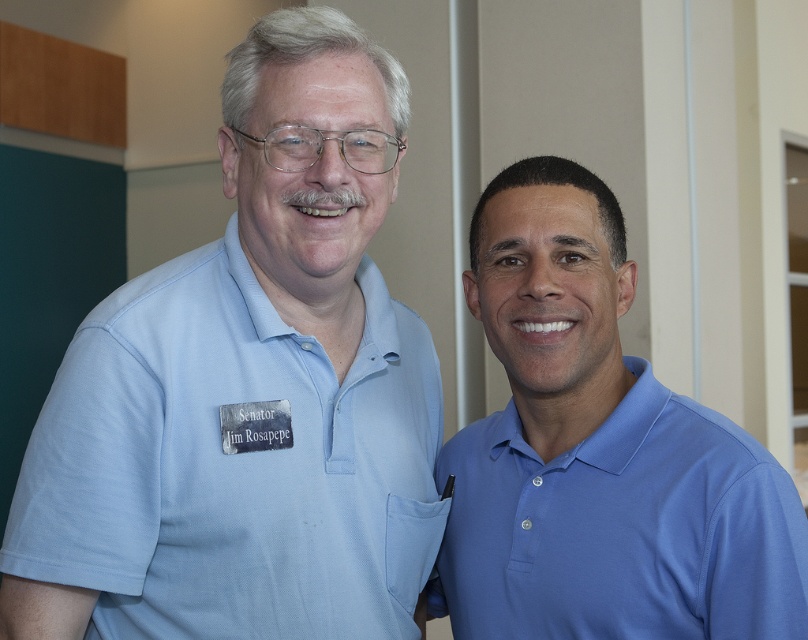
You are standing in front of a photo of two people. The person on the left is wearing a light blue polo shirt. If you were to place a sticker exactly at the center of the light blue polo shirt at left, what coordinates would you use?

The coordinates for the center of the light blue polo shirt at left are at point (247, 388).

You are a photographer setting up for a group photo. You notice two people wearing light blue polo shirt at left and blue smooth polo shirt at right. Since you want to ensure everyone is visible, which person should you position closer to the center to avoid being cut off if the frame is narrower on the sides?

The light blue polo shirt at left should be positioned closer to the center because it has a greater width than the blue smooth polo shirt at right, making it more likely to be cut off if placed near the edge of a narrow frame.

You are a photographer adjusting your camera settings to focus on the light blue polo shirt at left. The camera has a focus point at coordinates point (247, 388). Is this focus point correctly positioned to capture the light blue polo shirt at left?

Yes, the focus point at point (247, 388) is correctly positioned because the Objects Description states that this point corresponds to the light blue polo shirt at left.